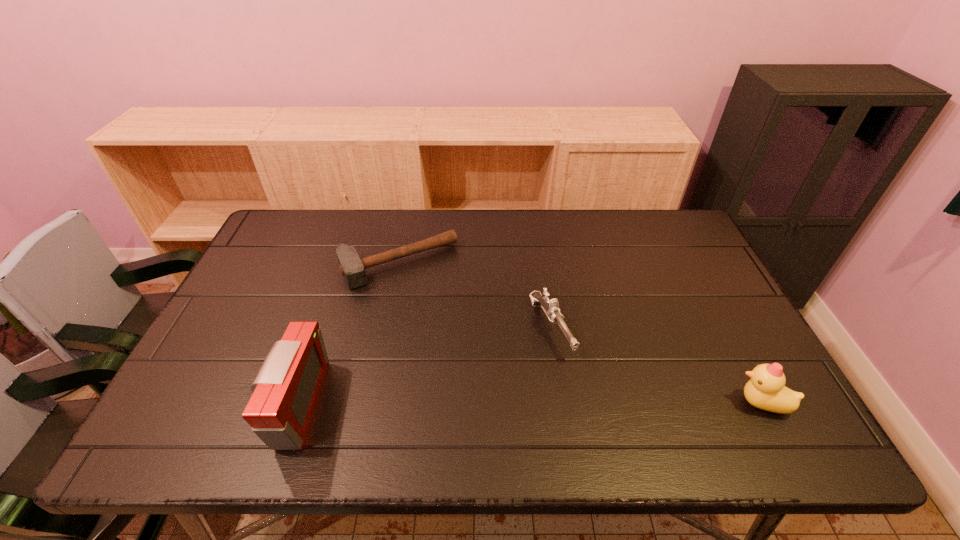
The height and width of the screenshot is (540, 960). Identify the location of vacant position in the image that satisfies the following two spatial constraints: 1. on the front side of the second tallest object; 2. on the front-facing side of the hammer. (371, 403).